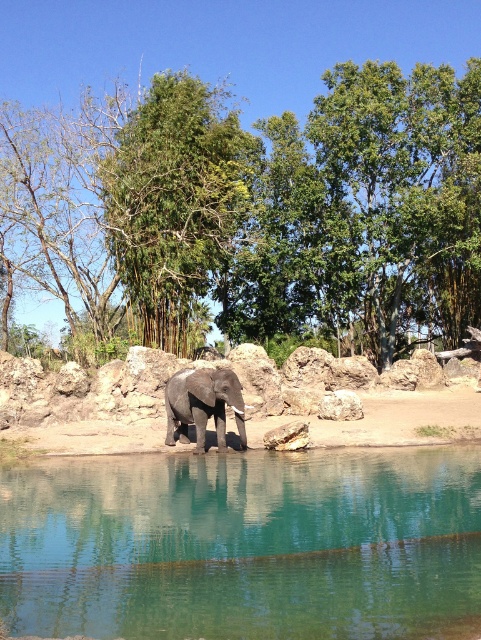
This screenshot has height=640, width=481. What do you see at coordinates (253, 211) in the screenshot?
I see `green leafy tree at center` at bounding box center [253, 211].

Does green leafy tree at center have a lesser width compared to green leafy tree at upper center?

Incorrect, green leafy tree at center's width is not less than green leafy tree at upper center's.

Does point (273, 296) lie in front of point (140, 120)?

No, it is behind (140, 120).

This screenshot has width=481, height=640. I want to click on green leafy tree at center, so click(253, 211).

This screenshot has height=640, width=481. What are the coordinates of `clear glass water at center` in the screenshot? It's located at (241, 545).

Between point (101, 554) and point (172, 154), which one is positioned behind?

Positioned behind is point (172, 154).

Locate an element on the screen. This screenshot has width=481, height=640. clear glass water at center is located at coordinates (241, 545).

Between green leafy tree at center and clear glass water at center, which one appears on the right side from the viewer's perspective?

Positioned to the right is clear glass water at center.

Who is positioned more to the left, green leafy tree at center or clear glass water at center?

From the viewer's perspective, green leafy tree at center appears more on the left side.

What do you see at coordinates (253, 211) in the screenshot? Image resolution: width=481 pixels, height=640 pixels. I see `green leafy tree at center` at bounding box center [253, 211].

At what (x,y) coordinates should I click in order to perform the action: click on green leafy tree at center. Please return your answer as a coordinate pair (x, y). Looking at the image, I should click on (253, 211).